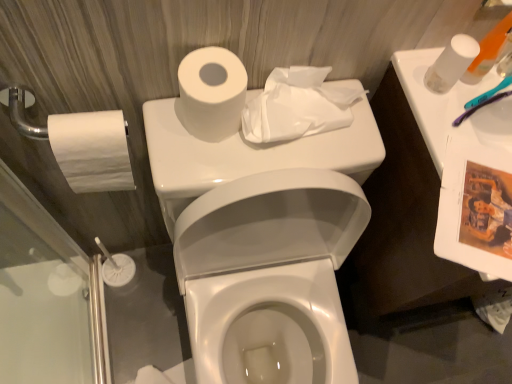
Question: Is white matte toilet paper at upper right, the 4th toilet paper in the left-to-right sequence, shorter than white matte toilet paper at upper center, acting as the second toilet paper starting from the left?

Choices:
 (A) no
 (B) yes

Answer: (B)

Question: Can you confirm if white matte toilet paper at upper right, the 4th toilet paper in the left-to-right sequence, is bigger than white matte toilet paper at upper center, which appears as the third toilet paper when viewed from the right?

Choices:
 (A) yes
 (B) no

Answer: (B)

Question: Is white matte toilet paper at upper right, the 4th toilet paper in the left-to-right sequence, to the right of white matte toilet paper at upper center, acting as the second toilet paper starting from the left, from the viewer's perspective?

Choices:
 (A) yes
 (B) no

Answer: (A)

Question: From a real-world perspective, is white matte toilet paper at upper right, positioned as the first toilet paper in right-to-left order, located higher than white matte toilet paper at upper center, which appears as the third toilet paper when viewed from the right?

Choices:
 (A) yes
 (B) no

Answer: (A)

Question: Is white matte toilet paper at upper right, positioned as the first toilet paper in right-to-left order, oriented away from white matte toilet paper at upper center, which appears as the third toilet paper when viewed from the right?

Choices:
 (A) no
 (B) yes

Answer: (A)

Question: Relative to white glossy toilet at center, is white matte toilet paper at upper right, the 4th toilet paper in the left-to-right sequence, in front or behind?

Choices:
 (A) front
 (B) behind

Answer: (B)

Question: From a real-world perspective, is white matte toilet paper at upper right, positioned as the first toilet paper in right-to-left order, positioned above or below white glossy toilet at center?

Choices:
 (A) below
 (B) above

Answer: (B)

Question: Looking at the image, does white matte toilet paper at upper right, positioned as the first toilet paper in right-to-left order, seem bigger or smaller compared to white glossy toilet at center?

Choices:
 (A) big
 (B) small

Answer: (B)

Question: Is white matte toilet paper at upper right, the 4th toilet paper in the left-to-right sequence, taller or shorter than white glossy toilet at center?

Choices:
 (A) tall
 (B) short

Answer: (B)

Question: Relative to white matte toilet paper at upper center, which appears as the third toilet paper when viewed from the right, is white plastic toothbrush at upper right, the 2th toiletry from the right, in front or behind?

Choices:
 (A) behind
 (B) front

Answer: (A)

Question: Considering the positions of white plastic toothbrush at upper right, the 2th toiletry from the right, and white matte toilet paper at upper center, which appears as the third toilet paper when viewed from the right, in the image, is white plastic toothbrush at upper right, the 2th toiletry from the right, wider or thinner than white matte toilet paper at upper center, which appears as the third toilet paper when viewed from the right,?

Choices:
 (A) thin
 (B) wide

Answer: (A)

Question: Does point (496, 56) appear closer or farther from the camera than point (181, 66)?

Choices:
 (A) farther
 (B) closer

Answer: (A)

Question: From the image's perspective, is white plastic toothbrush at upper right, the 2th toiletry from the right, above or below white matte toilet paper at upper center, which appears as the third toilet paper when viewed from the right?

Choices:
 (A) below
 (B) above

Answer: (B)

Question: Would you say white matte toilet paper at upper right, positioned as the first toilet paper in right-to-left order, is to the left or to the right of translucent plastic toothbrush at upper right, the second toiletry in the left-to-right sequence, in the picture?

Choices:
 (A) right
 (B) left

Answer: (B)

Question: Considering the positions of white matte toilet paper at upper right, the 4th toilet paper in the left-to-right sequence, and translucent plastic toothbrush at upper right, the second toiletry in the left-to-right sequence, in the image, is white matte toilet paper at upper right, the 4th toilet paper in the left-to-right sequence, taller or shorter than translucent plastic toothbrush at upper right, the second toiletry in the left-to-right sequence,?

Choices:
 (A) short
 (B) tall

Answer: (B)